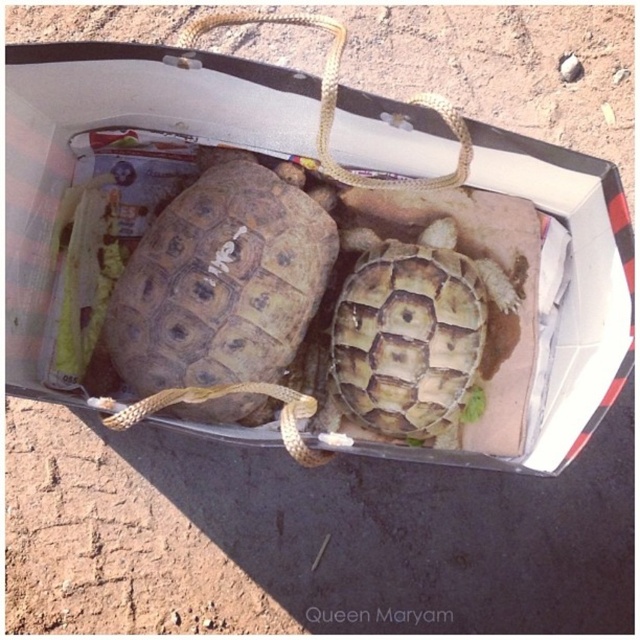
Is matte cardboard box at center shorter than brown textured tortoise at center?

No, matte cardboard box at center is not shorter than brown textured tortoise at center.

Which is in front, point (51, 164) or point (259, 358)?

Point (51, 164) is more forward.

This screenshot has width=640, height=640. I want to click on matte cardboard box at center, so click(109, 128).

Can you confirm if matte cardboard box at center is positioned above rusty metal tortoise at center?

Yes.

Who is more distant from viewer, (589,198) or (392,250)?

The point (392,250) is more distant.

Identify the location of matte cardboard box at center. This screenshot has height=640, width=640. (109, 128).

Does brown textured tortoise at center lie in front of rusty metal tortoise at center?

Yes, brown textured tortoise at center is in front of rusty metal tortoise at center.

Is point (168, 298) closer to camera compared to point (448, 216)?

Yes, it is in front of point (448, 216).

Find the location of a particular element. The image size is (640, 640). brown textured tortoise at center is located at coordinates (221, 288).